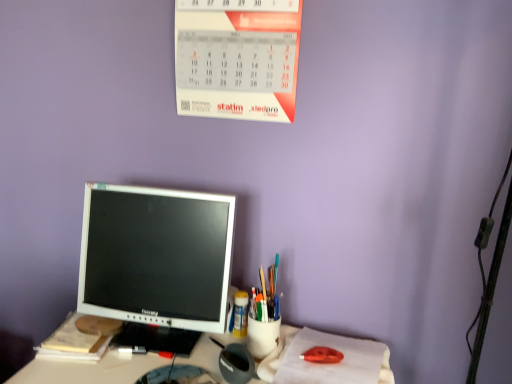
In order to click on vacant region above white glossy monitor at center (from a real-world perspective) in this screenshot , I will do `click(151, 359)`.